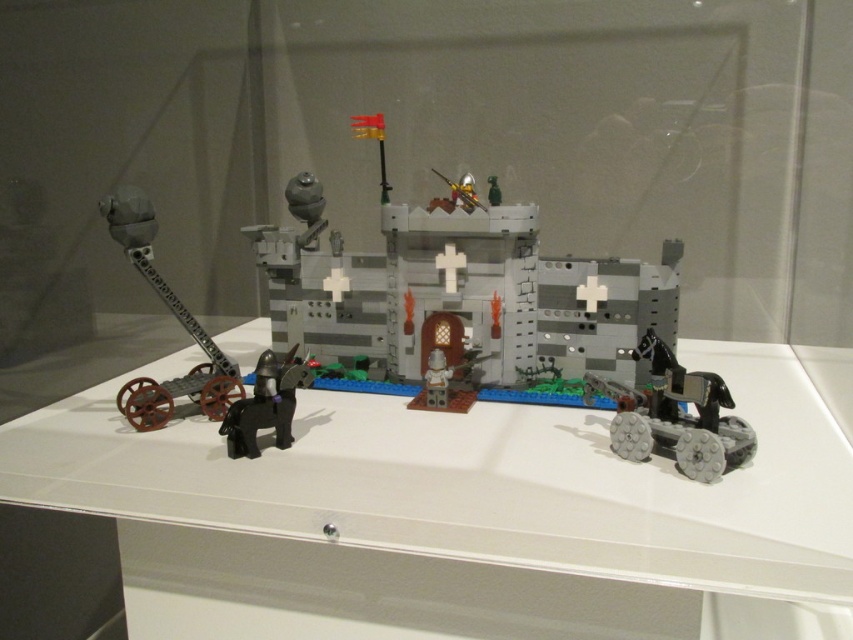
Does white plastic table at center appear on the right side of matte black horse at lower left?

Correct, you'll find white plastic table at center to the right of matte black horse at lower left.

Which is below, white plastic table at center or matte black horse at lower left?

white plastic table at center is lower down.

Find the location of a particular element. The image size is (853, 640). white plastic table at center is located at coordinates (483, 483).

Is metallic gray tank at lower right taller than metallic gold helmet at center?

Yes.

Between metallic gray tank at lower right and metallic gold helmet at center, which one is positioned higher?

metallic gold helmet at center

Image resolution: width=853 pixels, height=640 pixels. Describe the element at coordinates (675, 416) in the screenshot. I see `metallic gray tank at lower right` at that location.

The width and height of the screenshot is (853, 640). I want to click on metallic gray tank at lower right, so click(675, 416).

Is gray plastic castle at center closer to camera compared to metallic gray tank at lower right?

That is False.

Between gray plastic castle at center and metallic gray tank at lower right, which one has more height?

With more height is gray plastic castle at center.

Which is in front, point (740, 442) or point (672, 388)?

Positioned in front is point (740, 442).

This screenshot has height=640, width=853. I want to click on gray plastic castle at center, so click(498, 317).